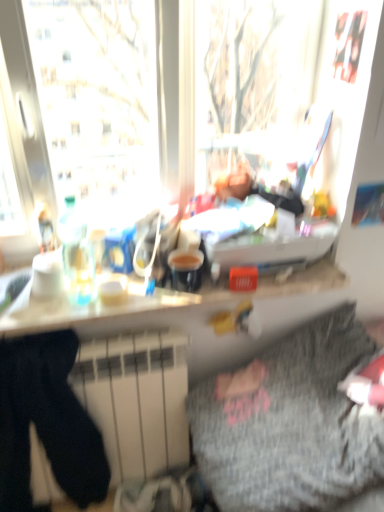
Question: Does white glossy counter top at center have a lesser height compared to white matte radiator at lower left?

Choices:
 (A) no
 (B) yes

Answer: (B)

Question: Are white glossy counter top at center and white matte radiator at lower left beside each other?

Choices:
 (A) yes
 (B) no

Answer: (B)

Question: Is white glossy counter top at center completely or partially outside of white matte radiator at lower left?

Choices:
 (A) no
 (B) yes

Answer: (B)

Question: Could you tell me if white glossy counter top at center is facing white matte radiator at lower left?

Choices:
 (A) yes
 (B) no

Answer: (B)

Question: Would you say white glossy counter top at center is a long distance from white matte radiator at lower left?

Choices:
 (A) yes
 (B) no

Answer: (B)

Question: Is white matte radiator at lower left a part of white glossy counter top at center?

Choices:
 (A) yes
 (B) no

Answer: (B)

Question: Is white glossy counter top at center closer to the viewer compared to gray textured blanket at lower right?

Choices:
 (A) yes
 (B) no

Answer: (B)

Question: Does white glossy counter top at center turn towards gray textured blanket at lower right?

Choices:
 (A) yes
 (B) no

Answer: (B)

Question: From a real-world perspective, is white glossy counter top at center on gray textured blanket at lower right?

Choices:
 (A) no
 (B) yes

Answer: (B)

Question: From the image's perspective, is white glossy counter top at center on top of gray textured blanket at lower right?

Choices:
 (A) yes
 (B) no

Answer: (A)

Question: Is white glossy counter top at center at the right side of gray textured blanket at lower right?

Choices:
 (A) no
 (B) yes

Answer: (A)

Question: Is white glossy counter top at center positioned with its back to gray textured blanket at lower right?

Choices:
 (A) yes
 (B) no

Answer: (B)

Question: Considering the relative sizes of white matte radiator at lower left and black cotton sweat pants at lower left in the image provided, is white matte radiator at lower left smaller than black cotton sweat pants at lower left?

Choices:
 (A) yes
 (B) no

Answer: (B)